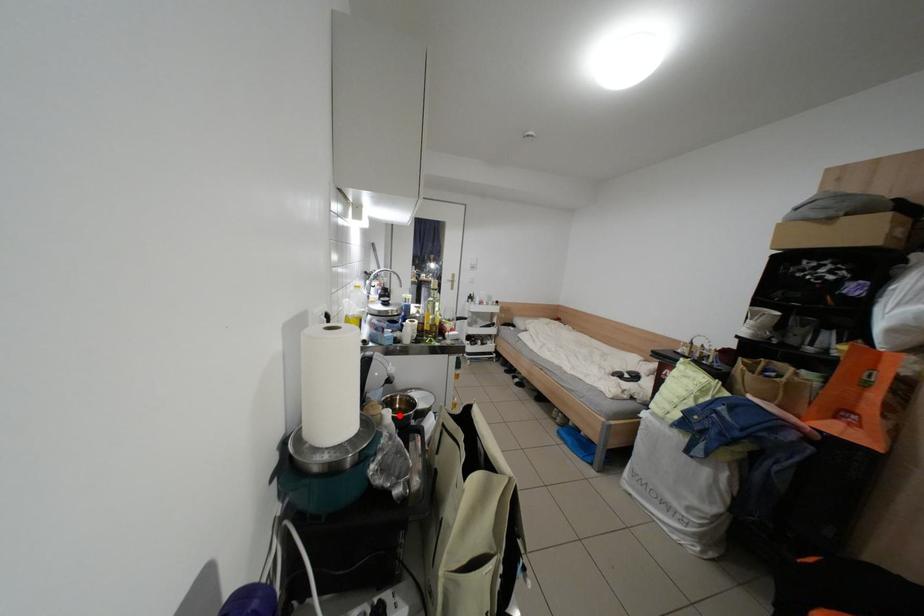
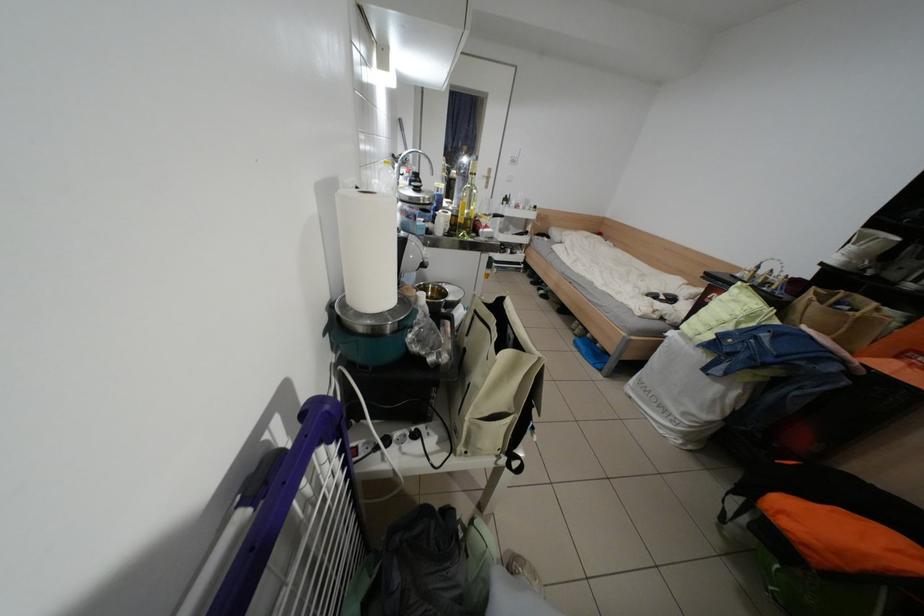
The point at the highlighted location is marked in the first image. Where is the corresponding point in the second image?

(433, 297)